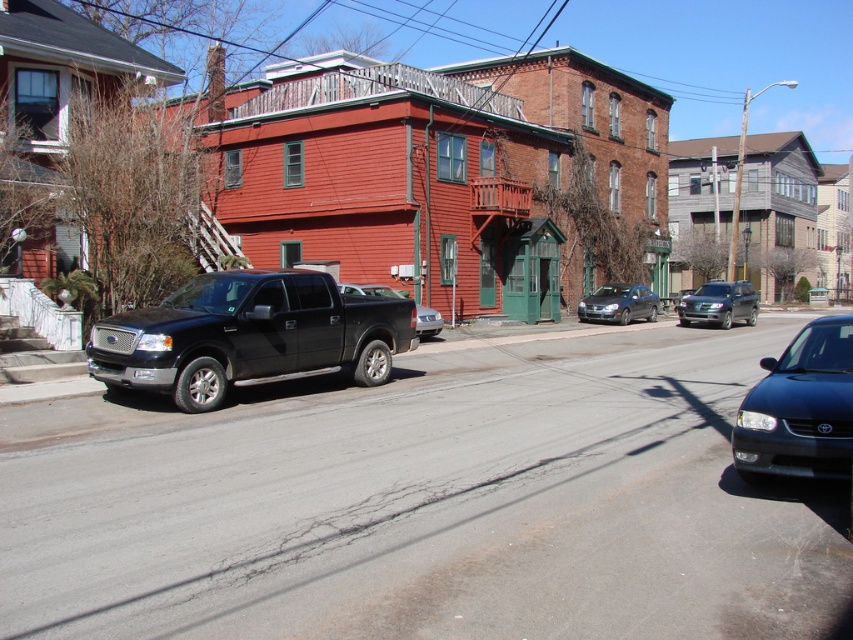
Question: Which object is closer to the camera taking this photo?

Choices:
 (A) metallic silver sedan at center
 (B) satin black sedan at lower right
 (C) metallic gray suv at center
 (D) satin silver sedan at center

Answer: (B)

Question: Estimate the real-world distances between objects in this image. Which object is farther from the metallic gray suv at center?

Choices:
 (A) metallic silver sedan at center
 (B) black matte pickup truck at center
 (C) satin black sedan at lower right

Answer: (C)

Question: Which object is the farthest from the satin silver sedan at center?

Choices:
 (A) metallic silver sedan at center
 (B) black matte pickup truck at center

Answer: (B)

Question: Does satin black sedan at lower right appear over metallic gray suv at center?

Choices:
 (A) yes
 (B) no

Answer: (B)

Question: Is metallic gray suv at center bigger than satin silver sedan at center?

Choices:
 (A) yes
 (B) no

Answer: (A)

Question: Can you confirm if satin silver sedan at center is positioned to the right of metallic silver sedan at center?

Choices:
 (A) yes
 (B) no

Answer: (A)